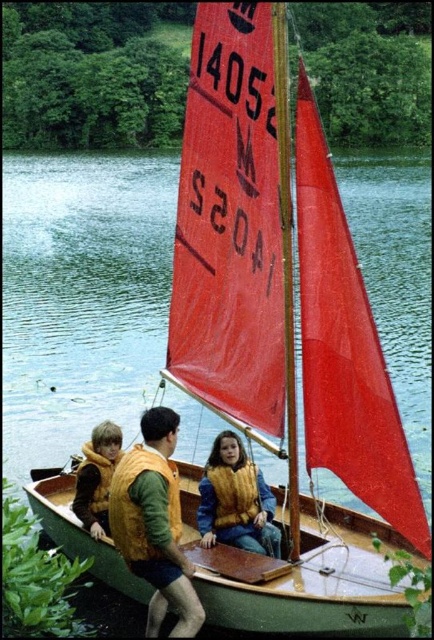
You are a safety inspector checking the boat for compliance. You notice the green water at center and the yellow fuzzy vest at left. Based on their positions, which object is closer to the right edge of the boat?

The green water at center is positioned on the right side of the yellow fuzzy vest at left, so it is closer to the right edge of the boat.

You are a photographer trying to capture the sailboat scene. You notice two points marked in the image. Which point, point 1 at coordinates (x=140, y=554) or point 2 at (x=89, y=522), is closer to your camera lens?

Point 1 at coordinates (x=140, y=554) is closer to the camera lens than point 2 at (x=89, y=522).